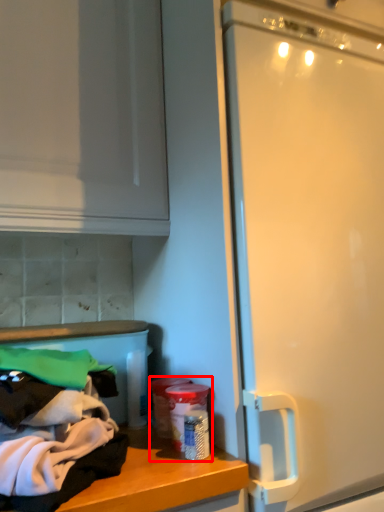
Question: From the image's perspective, where is garbage (annotated by the red box) located in relation to clothing in the image?

Choices:
 (A) below
 (B) above

Answer: (A)